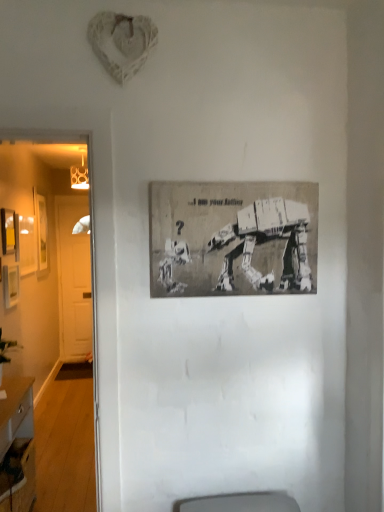
Find the location of a particular element. The width and height of the screenshot is (384, 512). wooden picture frame at left, marked as the first picture frame in a back-to-front arrangement is located at coordinates (41, 231).

I want to click on gray paper poster at center, placed as the first picture frame when sorted from front to back, so click(x=233, y=238).

The height and width of the screenshot is (512, 384). What do you see at coordinates (73, 277) in the screenshot?
I see `white wooden door at left` at bounding box center [73, 277].

In order to face white wooden door at left, should I rotate leftwards or rightwards?

Turn left by 15.371 degrees to look at white wooden door at left.

Image resolution: width=384 pixels, height=512 pixels. Identify the location of wooden picture frame at left, the 3th picture frame positioned from the front. (11, 285).

From the image's perspective, is white wooden door at left positioned above or below gray paper poster at center, the 4th picture frame positioned from the back?

white wooden door at left is below gray paper poster at center, the 4th picture frame positioned from the back.

From their relative heights in the image, would you say white wooden door at left is taller or shorter than gray paper poster at center, placed as the first picture frame when sorted from front to back?

Clearly, white wooden door at left is taller compared to gray paper poster at center, placed as the first picture frame when sorted from front to back.

Is white wooden door at left next to gray paper poster at center, acting as the 1th picture frame starting from the right, and touching it?

No, white wooden door at left is not in contact with gray paper poster at center, acting as the 1th picture frame starting from the right.

Could matte yellow picture frame at left, the 2th picture frame from the left, be considered to be inside wooden picture frame at left, marked as the second picture frame in a back-to-front arrangement?

No.

From a real-world perspective, which is physically below, wooden picture frame at left, which is the third picture frame in left-to-right order, or matte yellow picture frame at left, which is the third picture frame in right-to-left order?

From a 3D spatial view, wooden picture frame at left, which is the third picture frame in left-to-right order, is below.

What's the angular difference between wooden picture frame at left, marked as the second picture frame in a back-to-front arrangement, and matte yellow picture frame at left, which is the third picture frame in right-to-left order,'s facing directions?

0.000561 degrees.

From a real-world perspective, who is located lower, white wooden door at left or wooden desk at lower left?

From a 3D spatial view, wooden desk at lower left is below.

Is white wooden door at left oriented away from wooden desk at lower left?

No, white wooden door at left's orientation is not away from wooden desk at lower left.

Which is closer, (62,310) or (7,429)?

Point (62,310) appears to be farther away from the viewer than point (7,429).

Does wooden picture frame at left, the 3th picture frame positioned from the front, turn towards wooden desk at lower left?

A: No, wooden picture frame at left, the 3th picture frame positioned from the front, is not oriented towards wooden desk at lower left.

Is wooden picture frame at left, marked as the second picture frame in a back-to-front arrangement, wider or thinner than wooden desk at lower left?

wooden picture frame at left, marked as the second picture frame in a back-to-front arrangement, is thinner than wooden desk at lower left.

Is point (5, 271) closer to camera compared to point (7, 481)?

No.

Starting from the wooden desk at lower left, which picture frame is the 1st one to the left? Please provide its 2D coordinates.

[(11, 285)]

Which of these two, wooden desk at lower left or white wooden door at left, is smaller?

white wooden door at left is smaller.

Is white wooden door at left a part of wooden desk at lower left?

No, wooden desk at lower left does not contain white wooden door at left.

Is wooden desk at lower left aimed at white wooden door at left?

No.

In the scene shown: How many degrees apart are the facing directions of wooden picture frame at left, which is the third picture frame in left-to-right order, and wooden picture frame at left, marked as the first picture frame in a back-to-front arrangement?

The facing directions of wooden picture frame at left, which is the third picture frame in left-to-right order, and wooden picture frame at left, marked as the first picture frame in a back-to-front arrangement, are 0.000678 degrees apart.

Considering the sizes of objects wooden picture frame at left, marked as the second picture frame in a back-to-front arrangement, and wooden picture frame at left, the first picture frame positioned from the left, in the image provided, who is taller, wooden picture frame at left, marked as the second picture frame in a back-to-front arrangement, or wooden picture frame at left, the first picture frame positioned from the left,?

Standing taller between the two is wooden picture frame at left, the first picture frame positioned from the left.

In the scene shown: Looking at their sizes, would you say wooden picture frame at left, marked as the second picture frame in a back-to-front arrangement, is wider or thinner than wooden picture frame at left, the first picture frame positioned from the left?

Clearly, wooden picture frame at left, marked as the second picture frame in a back-to-front arrangement, has less width compared to wooden picture frame at left, the first picture frame positioned from the left.

Does wooden picture frame at left, which is the third picture frame in left-to-right order, touch wooden picture frame at left, arranged as the 4th picture frame when viewed from the right?

No, wooden picture frame at left, which is the third picture frame in left-to-right order, is not in contact with wooden picture frame at left, arranged as the 4th picture frame when viewed from the right.

From the image's perspective, would you say gray paper poster at center, acting as the 1th picture frame starting from the right, is shown under wooden picture frame at left, the 2th picture frame in the right-to-left sequence?

No, from the image's perspective, gray paper poster at center, acting as the 1th picture frame starting from the right, is not below wooden picture frame at left, the 2th picture frame in the right-to-left sequence.

Considering the sizes of objects gray paper poster at center, placed as the first picture frame when sorted from front to back, and wooden picture frame at left, which is the third picture frame in left-to-right order, in the image provided, who is shorter, gray paper poster at center, placed as the first picture frame when sorted from front to back, or wooden picture frame at left, which is the third picture frame in left-to-right order,?

wooden picture frame at left, which is the third picture frame in left-to-right order, is shorter.

Looking at this image, can you confirm if gray paper poster at center, placed as the first picture frame when sorted from front to back, is bigger than wooden picture frame at left, the 2th picture frame in the right-to-left sequence?

Indeed, gray paper poster at center, placed as the first picture frame when sorted from front to back, has a larger size compared to wooden picture frame at left, the 2th picture frame in the right-to-left sequence.

Starting from the white wooden door at left, which picture frame is the 3rd one to the right? Please provide its 2D coordinates.

[(233, 238)]

Which picture frame is the 1st one when counting from the front of the wooden picture frame at left, the 2th picture frame in the right-to-left sequence? Please provide its 2D coordinates.

[(8, 231)]

Estimate the real-world distances between objects in this image. Which object is closer to wooden desk at lower left, wooden picture frame at left, the 2th picture frame in the right-to-left sequence, or gray paper poster at center, the 4th picture frame positioned from the back?

wooden picture frame at left, the 2th picture frame in the right-to-left sequence, is closer to wooden desk at lower left.

Based on their spatial positions, is wooden desk at lower left or wooden picture frame at left, marked as the second picture frame in a back-to-front arrangement, further from wooden picture frame at left, the first picture frame positioned from the left?

wooden desk at lower left lies further to wooden picture frame at left, the first picture frame positioned from the left, than the other object.

When comparing their distances from gray paper poster at center, acting as the 1th picture frame starting from the right, does matte yellow picture frame at left, which appears as the 2th picture frame when viewed from the front, or wooden picture frame at left, arranged as the 4th picture frame when viewed from the right, seem closer?

matte yellow picture frame at left, which appears as the 2th picture frame when viewed from the front, is positioned closer to the anchor gray paper poster at center, acting as the 1th picture frame starting from the right.

Based on their spatial positions, is wooden desk at lower left or wooden picture frame at left, arranged as the 4th picture frame when viewed from the right, closer to wooden picture frame at left, which is the third picture frame in left-to-right order?

wooden desk at lower left is positioned closer to the anchor wooden picture frame at left, which is the third picture frame in left-to-right order.

From the image, which object appears to be nearer to wooden picture frame at left, marked as the first picture frame in a back-to-front arrangement, wooden desk at lower left or matte yellow picture frame at left, which ranks as the 3th picture frame in back-to-front order?

matte yellow picture frame at left, which ranks as the 3th picture frame in back-to-front order.

Considering their positions, is matte yellow picture frame at left, which ranks as the 3th picture frame in back-to-front order, positioned closer to wooden desk at lower left than white wooden door at left?

matte yellow picture frame at left, which ranks as the 3th picture frame in back-to-front order, is closer to wooden desk at lower left.

Looking at the image, which one is located closer to gray paper poster at center, which is the fourth picture frame in left-to-right order, wooden desk at lower left or white wooden door at left?

wooden desk at lower left.

When comparing their distances from white wooden door at left, does gray paper poster at center, acting as the 1th picture frame starting from the right, or wooden picture frame at left, which is the third picture frame in left-to-right order, seem further?

Based on the image, gray paper poster at center, acting as the 1th picture frame starting from the right, appears to be further to white wooden door at left.

Where is `picture frame between gray paper poster at center, the 4th picture frame positioned from the back, and wooden picture frame at left, the 2th picture frame in the right-to-left sequence, in the front-back direction`? picture frame between gray paper poster at center, the 4th picture frame positioned from the back, and wooden picture frame at left, the 2th picture frame in the right-to-left sequence, in the front-back direction is located at coordinates (8, 231).

This screenshot has width=384, height=512. Identify the location of picture frame between wooden picture frame at left, the 3th picture frame positioned from the front, and white wooden door at left from front to back. click(x=41, y=231).

Identify the location of desk located between gray paper poster at center, the 4th picture frame positioned from the back, and white wooden door at left in the depth direction. (17, 446).

Locate an element on the screen. The image size is (384, 512). picture frame between wooden desk at lower left and wooden picture frame at left, marked as the second picture frame in a back-to-front arrangement, along the z-axis is located at coordinates (8, 231).